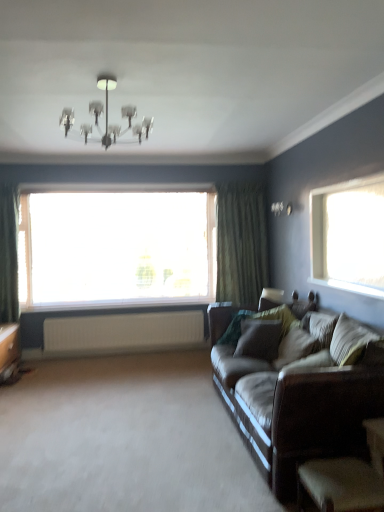
Question: From the image's perspective, is white plastic window sill at center located above or below white ribbed radiator at lower center?

Choices:
 (A) below
 (B) above

Answer: (B)

Question: Is point (79, 307) closer or farther from the camera than point (127, 315)?

Choices:
 (A) farther
 (B) closer

Answer: (A)

Question: Which of these objects is positioned closest to the green textured curtain at right?

Choices:
 (A) dark brown leather armchair at lower right
 (B) white plastic window sill at center
 (C) white ribbed radiator at lower center
 (D) transparent glass window at center
 (E) brown leather couch at right

Answer: (D)

Question: Estimate the real-world distances between objects in this image. Which object is closer to the brown leather couch at right?

Choices:
 (A) transparent glass window at center
 (B) white ribbed radiator at lower center
 (C) green textured curtain at right
 (D) brown leather couch at lower right
 (E) metallic chandelier at upper center

Answer: (D)